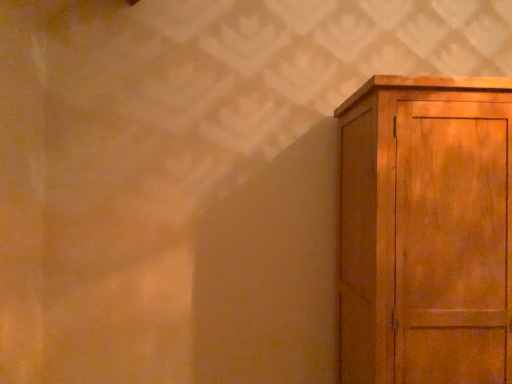
Describe the element at coordinates (426, 231) in the screenshot. I see `wooden cabinet at right` at that location.

Locate an element on the screen. This screenshot has width=512, height=384. wooden cabinet at right is located at coordinates (426, 231).

In order to click on wooden cabinet at right in this screenshot , I will do `click(426, 231)`.